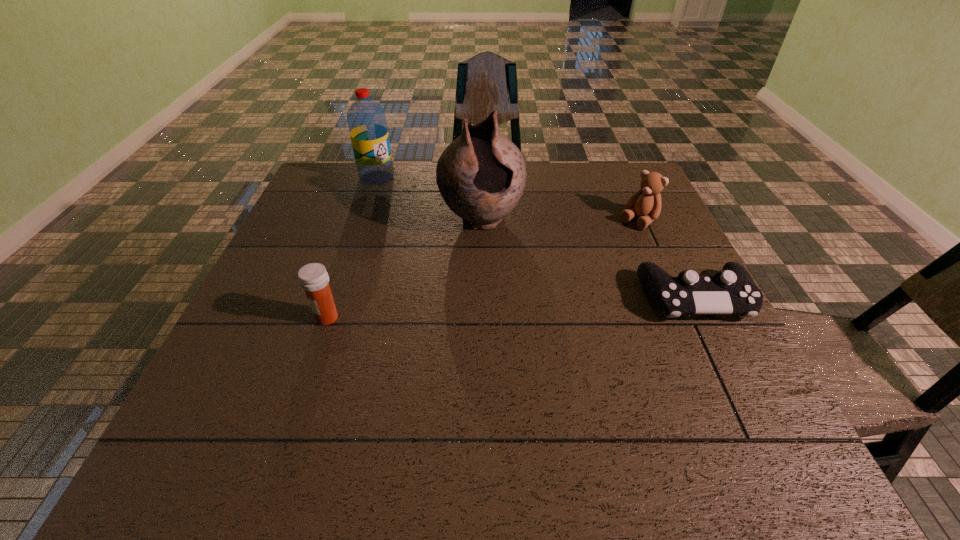
This screenshot has width=960, height=540. What are the coordinates of `vacant space on the desktop that is between the medicine and the control and is positioned on the front-facing side of the teddy bear` in the screenshot? It's located at (546, 306).

I want to click on vacant spot on the desktop that is between the medicine and the shortest object and is positioned from the spout of the pottery, so click(x=516, y=307).

Where is `free spot on the desktop that is between the medicine and the shortest object and is positioned on the front label of the second tallest object`? This screenshot has height=540, width=960. free spot on the desktop that is between the medicine and the shortest object and is positioned on the front label of the second tallest object is located at coordinates coord(499,308).